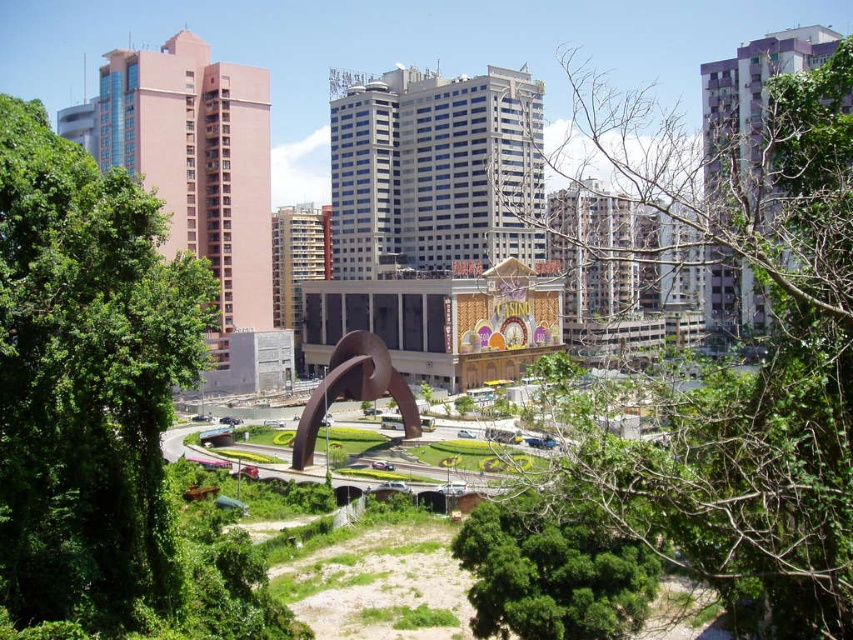
You are standing in the urban landscape and want to take a photo of the green leafy tree at center. If your camera has a maximum focus range of 40 meters, will you be able to capture the tree clearly without moving closer?

The green leafy tree at center is 43.40 meters away from the viewer. Since the camera can only focus up to 40 meters, you won cannot capture the tree clearly without moving closer.

You are a landscape architect planning to install a new pathway between the green leafy tree at left and the green leafy tree at lower center. Based on their positions, which direction should the pathway be oriented to connect them?

The pathway should be oriented from left to right to connect the green leafy tree at left and the green leafy tree at lower center since the green leafy tree at left is positioned to the left of the green leafy tree at lower center.

You are a city planner reviewing the urban landscape. The green leafy tree at center and the brown polished metal sculpture at center are both in the central area of the park. Considering their heights, which one would cast a longer shadow during midday when the sun is directly overhead?

The green leafy tree at center is much taller than the brown polished metal sculpture at center, so it would cast a longer shadow during midday when the sun is directly overhead.